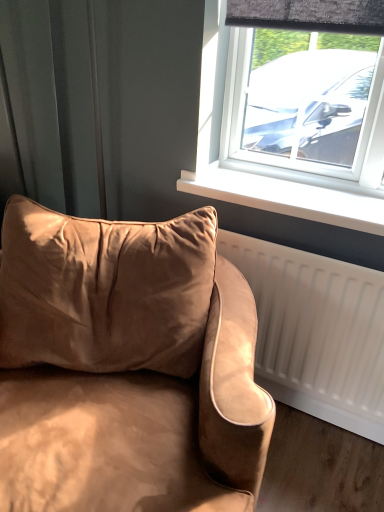
The image size is (384, 512). What do you see at coordinates (126, 366) in the screenshot?
I see `suede-like beige couch at lower left` at bounding box center [126, 366].

I want to click on suede-like beige couch at lower left, so click(126, 366).

What do you see at coordinates (286, 196) in the screenshot? The image size is (384, 512). I see `white plastic window sill at center` at bounding box center [286, 196].

Measure the distance between point (x=340, y=209) and camera.

Point (x=340, y=209) and camera are 1.41 meters apart from each other.

Locate an element on the screen. The image size is (384, 512). white plastic window sill at center is located at coordinates (286, 196).

Locate an element on the screen. The image size is (384, 512). suede-like beige couch at lower left is located at coordinates (126, 366).

Is suede-like beige couch at lower left at the right side of white plastic window sill at center?

In fact, suede-like beige couch at lower left is to the left of white plastic window sill at center.

In the image, is suede-like beige couch at lower left positioned in front of or behind white plastic window sill at center?

In the image, suede-like beige couch at lower left appears in front of white plastic window sill at center.

Is point (106, 336) in front of point (382, 201)?

That is True.

From the image's perspective, is suede-like beige couch at lower left below white plastic window sill at center?

Indeed, from the image's perspective, suede-like beige couch at lower left is shown beneath white plastic window sill at center.

From a real-world perspective, is suede-like beige couch at lower left positioned under white plastic window sill at center based on gravity?

Indeed, from a real-world perspective, suede-like beige couch at lower left is positioned beneath white plastic window sill at center.

Looking at their sizes, would you say suede-like beige couch at lower left is wider or thinner than white plastic window sill at center?

Clearly, suede-like beige couch at lower left has more width compared to white plastic window sill at center.

Is suede-like beige couch at lower left taller or shorter than white plastic window sill at center?

suede-like beige couch at lower left is taller than white plastic window sill at center.

Is suede-like beige couch at lower left bigger than white plastic window sill at center?

Correct, suede-like beige couch at lower left is larger in size than white plastic window sill at center.

From the picture: Is suede-like beige couch at lower left inside the boundaries of white plastic window sill at center, or outside?

suede-like beige couch at lower left cannot be found inside white plastic window sill at center.

Can you see suede-like beige couch at lower left touching white plastic window sill at center?

No, suede-like beige couch at lower left is not touching white plastic window sill at center.

Could you tell me if suede-like beige couch at lower left is facing white plastic window sill at center?

No, suede-like beige couch at lower left does not turn towards white plastic window sill at center.

How different are the orientations of suede-like beige couch at lower left and white plastic window sill at center in degrees?

22.2 degrees separate the facing orientations of suede-like beige couch at lower left and white plastic window sill at center.

The height and width of the screenshot is (512, 384). Identify the location of window sill lying on the right of suede-like beige couch at lower left. (286, 196).

Is white plastic window sill at center at the left side of suede-like beige couch at lower left?

No, white plastic window sill at center is not to the left of suede-like beige couch at lower left.

Who is more distant, white plastic window sill at center or suede-like beige couch at lower left?

white plastic window sill at center is further away from the camera.

Is point (202, 196) less distant than point (113, 324)?

No, it is not.

From the image's perspective, between white plastic window sill at center and suede-like beige couch at lower left, which one is located above?

From the image's view, white plastic window sill at center is above.

From a real-world perspective, is white plastic window sill at center on top of suede-like beige couch at lower left?

Yes, from a real-world perspective, white plastic window sill at center is above suede-like beige couch at lower left.

Which of these two, white plastic window sill at center or suede-like beige couch at lower left, is wider?

suede-like beige couch at lower left is wider.

Which of these two, white plastic window sill at center or suede-like beige couch at lower left, stands taller?

Standing taller between the two is suede-like beige couch at lower left.

Based on their sizes in the image, would you say white plastic window sill at center is bigger or smaller than suede-like beige couch at lower left?

In the image, white plastic window sill at center appears to be smaller than suede-like beige couch at lower left.

Can we say white plastic window sill at center lies outside suede-like beige couch at lower left?

Indeed, white plastic window sill at center is completely outside suede-like beige couch at lower left.

Can you see white plastic window sill at center touching suede-like beige couch at lower left?

No, white plastic window sill at center is not with suede-like beige couch at lower left.

Is white plastic window sill at center oriented away from suede-like beige couch at lower left?

No, white plastic window sill at center is not facing away from suede-like beige couch at lower left.

You are a GUI agent. You are given a task and a screenshot of the screen. Output one action in this format:
    pyautogui.click(x=<x>, y=<y>)
    Task: Click on the studio couch to the left of white plastic window sill at center
    
    Given the screenshot: What is the action you would take?
    pyautogui.click(x=126, y=366)

The height and width of the screenshot is (512, 384). I want to click on window sill that appears above the suede-like beige couch at lower left (from a real-world perspective), so click(x=286, y=196).

Identify the location of studio couch on the left of white plastic window sill at center. click(x=126, y=366).